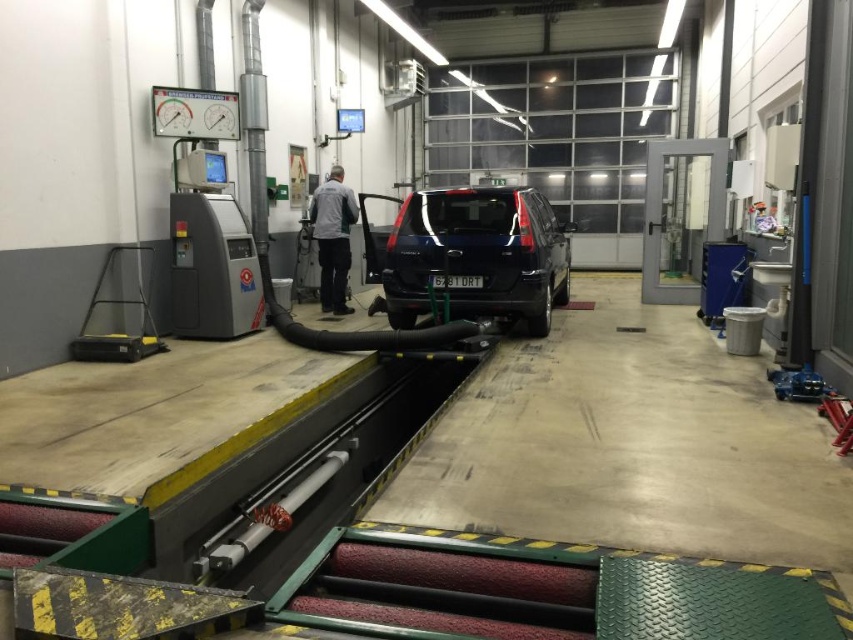
Question: Which point appears closest to the camera in this image?

Choices:
 (A) (413, 317)
 (B) (339, 182)

Answer: (A)

Question: Can you confirm if glossy black suv at center is positioned to the right of gray fabric jacket at center?

Choices:
 (A) no
 (B) yes

Answer: (B)

Question: Does glossy black suv at center have a greater width compared to gray fabric jacket at center?

Choices:
 (A) yes
 (B) no

Answer: (A)

Question: Is glossy black suv at center above gray fabric jacket at center?

Choices:
 (A) yes
 (B) no

Answer: (B)

Question: Which object is farther from the camera taking this photo?

Choices:
 (A) glossy black suv at center
 (B) gray fabric jacket at center

Answer: (B)